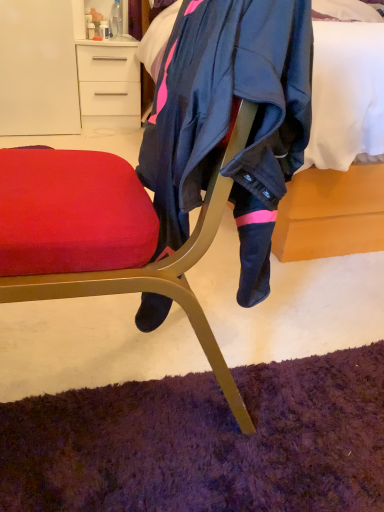
This screenshot has width=384, height=512. What do you see at coordinates (109, 87) in the screenshot?
I see `white glossy drawer at upper left` at bounding box center [109, 87].

At what (x,y) coordinates should I click in order to perform the action: click on white glossy drawer at upper left. Please return your answer as a coordinate pair (x, y). The image size is (384, 512). Looking at the image, I should click on (109, 87).

This screenshot has width=384, height=512. Describe the element at coordinates (332, 213) in the screenshot. I see `soft white bed at upper center` at that location.

Where is `soft white bed at upper center`? soft white bed at upper center is located at coordinates (332, 213).

Where is `white glossy drawer at upper left`? white glossy drawer at upper left is located at coordinates (109, 87).

Would you say white glossy drawer at upper left is to the left or to the right of soft white bed at upper center in the picture?

From the image, it's evident that white glossy drawer at upper left is to the left of soft white bed at upper center.

Considering the relative positions of white glossy drawer at upper left and soft white bed at upper center in the image provided, is white glossy drawer at upper left in front of soft white bed at upper center?

No.

Considering the points (77, 63) and (311, 181), which point is in front, point (77, 63) or point (311, 181)?

Point (311, 181)

From the image's perspective, would you say white glossy drawer at upper left is positioned over soft white bed at upper center?

Yes.

From a real-world perspective, is white glossy drawer at upper left positioned over soft white bed at upper center based on gravity?

No.

Is white glossy drawer at upper left wider than soft white bed at upper center?

No, white glossy drawer at upper left is not wider than soft white bed at upper center.

Who is taller, white glossy drawer at upper left or soft white bed at upper center?

Standing taller between the two is soft white bed at upper center.

Considering the relative sizes of white glossy drawer at upper left and soft white bed at upper center in the image provided, is white glossy drawer at upper left bigger than soft white bed at upper center?

Actually, white glossy drawer at upper left might be smaller than soft white bed at upper center.

Is white glossy drawer at upper left spatially inside soft white bed at upper center, or outside of it?

white glossy drawer at upper left is outside soft white bed at upper center.

Is white glossy drawer at upper left not near soft white bed at upper center?

Indeed, white glossy drawer at upper left is not near soft white bed at upper center.

Is white glossy drawer at upper left aimed at soft white bed at upper center?

No, white glossy drawer at upper left is not facing towards soft white bed at upper center.

How far apart are white glossy drawer at upper left and soft white bed at upper center?

white glossy drawer at upper left is 5.43 feet from soft white bed at upper center.

Image resolution: width=384 pixels, height=512 pixels. Find the location of `desk behind the soft white bed at upper center`. desk behind the soft white bed at upper center is located at coordinates (109, 87).

Considering the positions of objects soft white bed at upper center and white glossy drawer at upper left in the image provided, who is more to the left, soft white bed at upper center or white glossy drawer at upper left?

white glossy drawer at upper left is more to the left.

Is soft white bed at upper center positioned in front of white glossy drawer at upper left?

Yes, it is in front of white glossy drawer at upper left.

Is point (333, 194) farther from viewer compared to point (88, 56)?

That is False.

From the image's perspective, would you say soft white bed at upper center is shown under white glossy drawer at upper left?

Yes, from the image's perspective, soft white bed at upper center is below white glossy drawer at upper left.

From a real-world perspective, is soft white bed at upper center below white glossy drawer at upper left?

No, from a real-world perspective, soft white bed at upper center is not below white glossy drawer at upper left.

Which object is wider, soft white bed at upper center or white glossy drawer at upper left?

Wider between the two is soft white bed at upper center.

Can you confirm if soft white bed at upper center is taller than white glossy drawer at upper left?

Yes.

Considering the sizes of soft white bed at upper center and white glossy drawer at upper left in the image, is soft white bed at upper center bigger or smaller than white glossy drawer at upper left?

Considering their sizes, soft white bed at upper center takes up more space than white glossy drawer at upper left.

Is soft white bed at upper center situated inside white glossy drawer at upper left or outside?

soft white bed at upper center cannot be found inside white glossy drawer at upper left.

Is soft white bed at upper center far away from white glossy drawer at upper left?

Yes, soft white bed at upper center and white glossy drawer at upper left are quite far apart.

Is soft white bed at upper center facing towards white glossy drawer at upper left?

No, soft white bed at upper center does not turn towards white glossy drawer at upper left.

Can you tell me how much soft white bed at upper center and white glossy drawer at upper left differ in facing direction?

The angle between the facing direction of soft white bed at upper center and the facing direction of white glossy drawer at upper left is 1.82 degrees.

This screenshot has width=384, height=512. I want to click on bed lying below the white glossy drawer at upper left (from the image's perspective), so click(332, 213).

Locate an element on the screen. This screenshot has height=512, width=384. bed on the right of white glossy drawer at upper left is located at coordinates (332, 213).

Where is `desk located underneath the soft white bed at upper center (from a real-world perspective)`? The image size is (384, 512). desk located underneath the soft white bed at upper center (from a real-world perspective) is located at coordinates (109, 87).